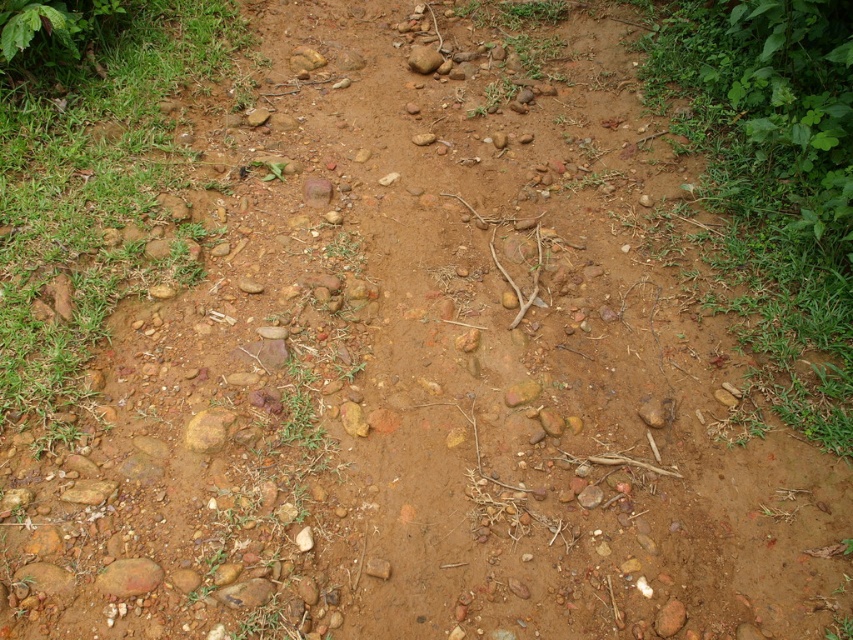
Can you confirm if green grass at left is positioned below green leafy plant at right?

Indeed, green grass at left is positioned under green leafy plant at right.

Is green grass at left positioned behind green leafy plant at right?

No, green grass at left is in front of green leafy plant at right.

The image size is (853, 640). What do you see at coordinates (99, 198) in the screenshot?
I see `green grass at left` at bounding box center [99, 198].

The width and height of the screenshot is (853, 640). Identify the location of green grass at left. (99, 198).

Between brown rough rock at lower left and smooth brown rock at center, which one has more height?

With more height is smooth brown rock at center.

Between point (138, 586) and point (416, 51), which one is positioned behind?

The point (416, 51) is more distant.

Is point (102, 589) farther from viewer compared to point (422, 64)?

No, (102, 589) is in front of (422, 64).

Locate an element on the screen. Image resolution: width=853 pixels, height=640 pixels. brown rough rock at lower left is located at coordinates (128, 577).

Is green leafy plant at right thinner than yellow rough stone at center?

No, green leafy plant at right is not thinner than yellow rough stone at center.

Can you confirm if green leafy plant at right is positioned to the right of yellow rough stone at center?

Yes, green leafy plant at right is to the right of yellow rough stone at center.

At what (x,y) coordinates should I click in order to perform the action: click on green leafy plant at right. Please return your answer as a coordinate pair (x, y). Looking at the image, I should click on (776, 182).

Where is `green leafy plant at right`? green leafy plant at right is located at coordinates (776, 182).